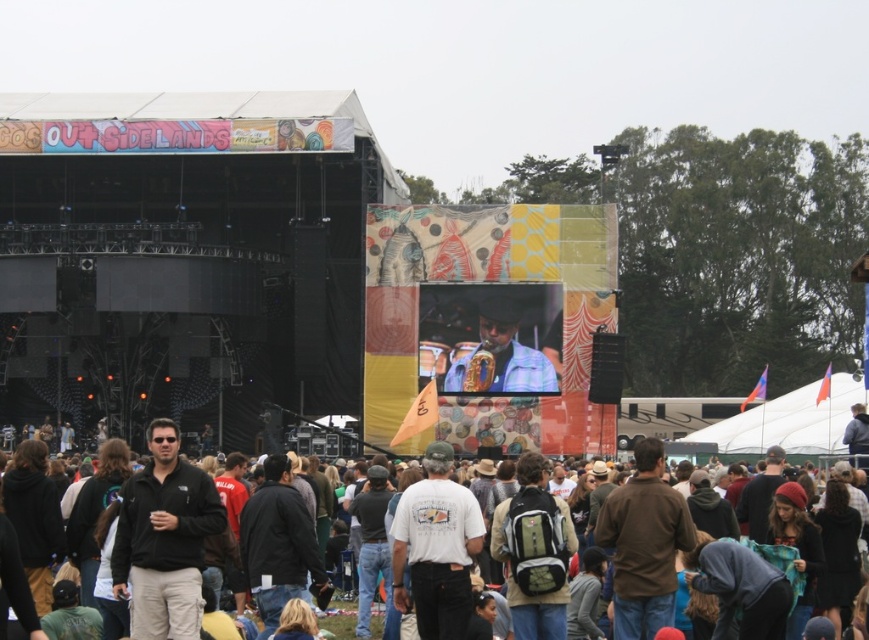
You are at the Outside Lands music festival and see a person wearing a matte blue shirt at center. Where exactly are they located in the image?

The matte blue shirt at center is located at point coordinates of [503,355].